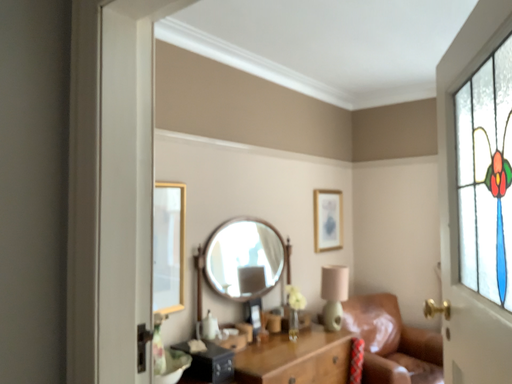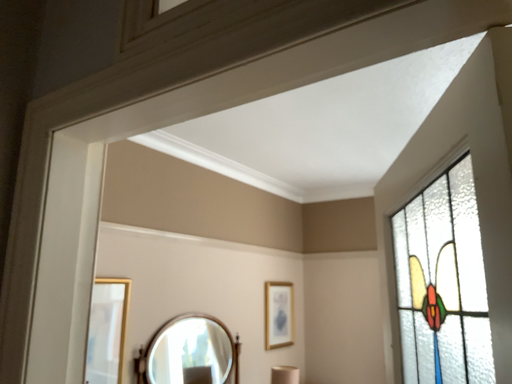
Question: Which way did the camera rotate in the video?

Choices:
 (A) rotated left
 (B) rotated right

Answer: (B)